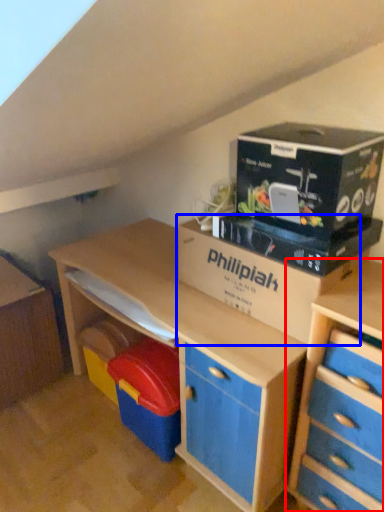
Question: Among these objects, which one is farthest to the camera, chest of drawers (highlighted by a red box) or cardboard box (highlighted by a blue box)?

Choices:
 (A) chest of drawers
 (B) cardboard box

Answer: (B)